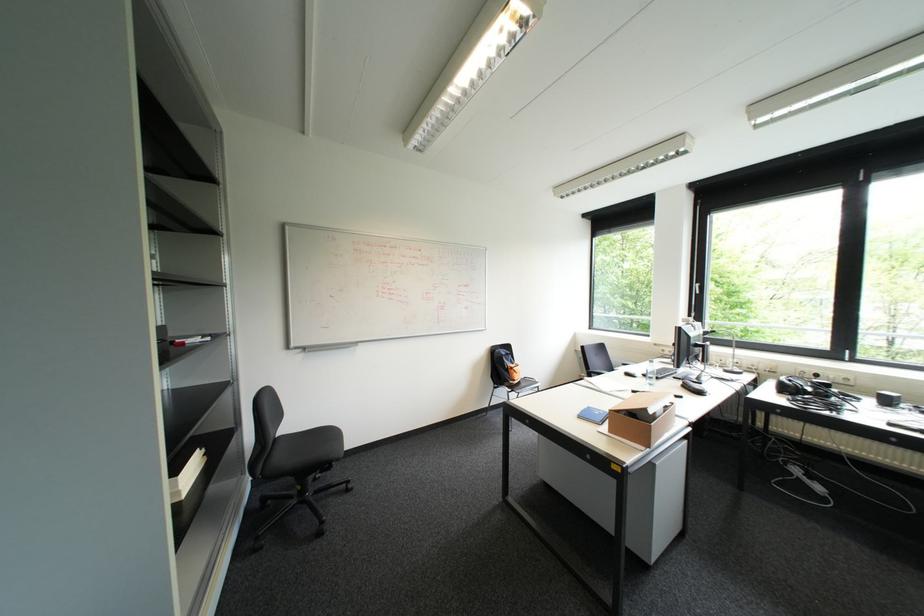
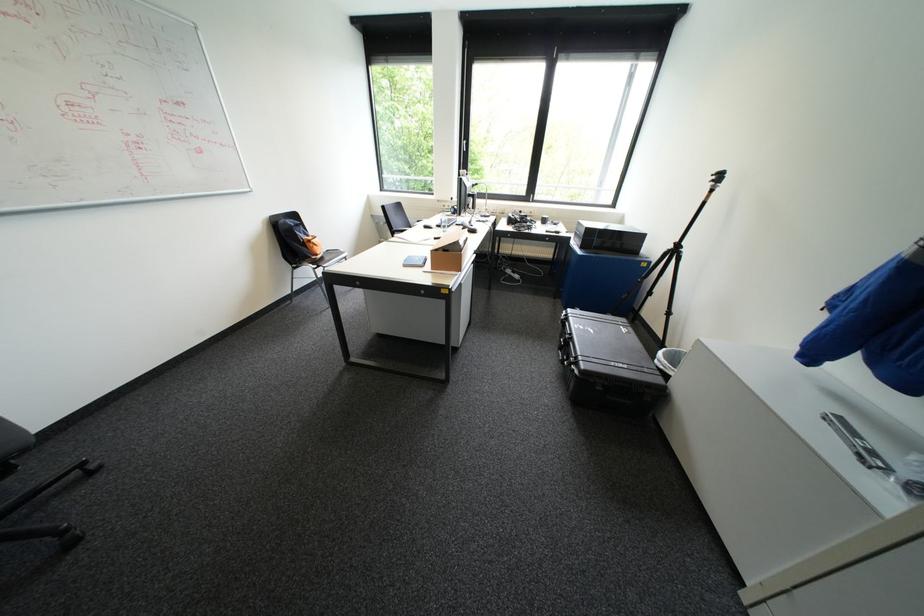
Find the pixel in the second image that matches pixel 641 390 in the first image.

(444, 237)